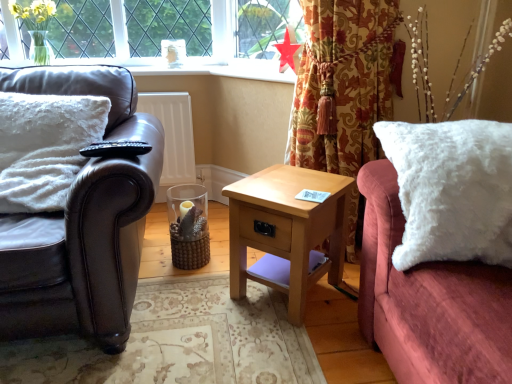
Question: Is light wood/texture nightstand at center in front of or behind white fluffy pillow at right in the image?

Choices:
 (A) behind
 (B) front

Answer: (A)

Question: Is light wood/texture nightstand at center spatially inside white fluffy pillow at right, or outside of it?

Choices:
 (A) inside
 (B) outside

Answer: (B)

Question: Estimate the real-world distances between objects in this image. Which object is farther from the white fluffy pillow at left?

Choices:
 (A) white fluffy pillow at right
 (B) floral fabric curtain at upper right
 (C) leather couch at left
 (D) red paper star at upper center
 (E) light wood/texture nightstand at center

Answer: (A)

Question: Which is farther from the white fluffy pillow at right?

Choices:
 (A) floral fabric curtain at upper right
 (B) light wood/texture nightstand at center
 (C) red paper star at upper center
 (D) white fluffy pillow at left
 (E) leather couch at left

Answer: (C)